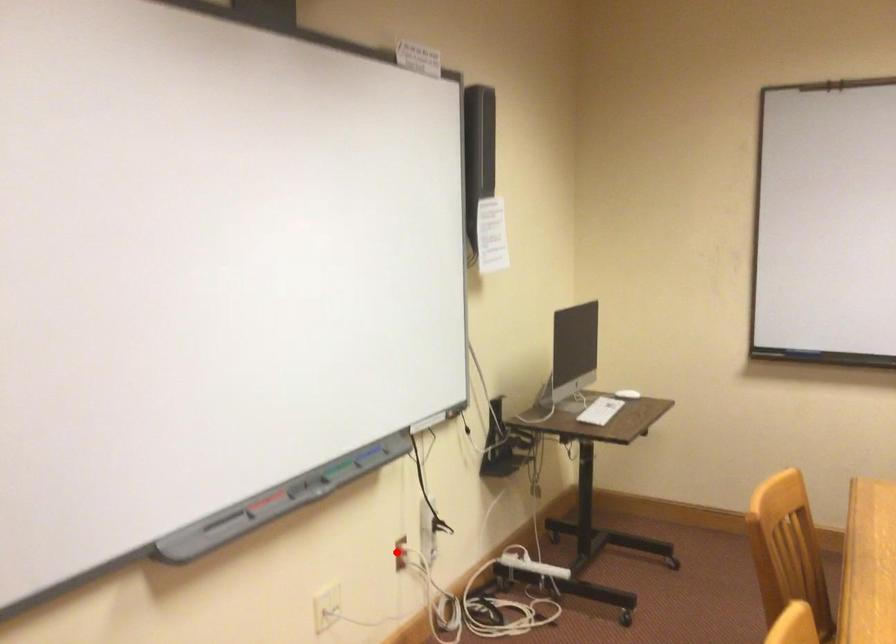
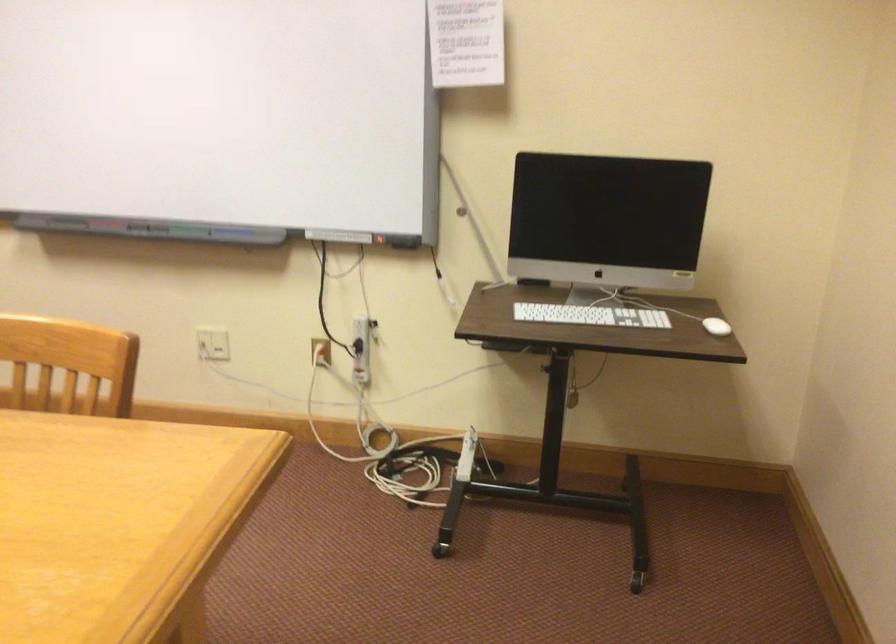
The point at the highlighted location is marked in the first image. Where is the corresponding point in the second image?

(321, 351)